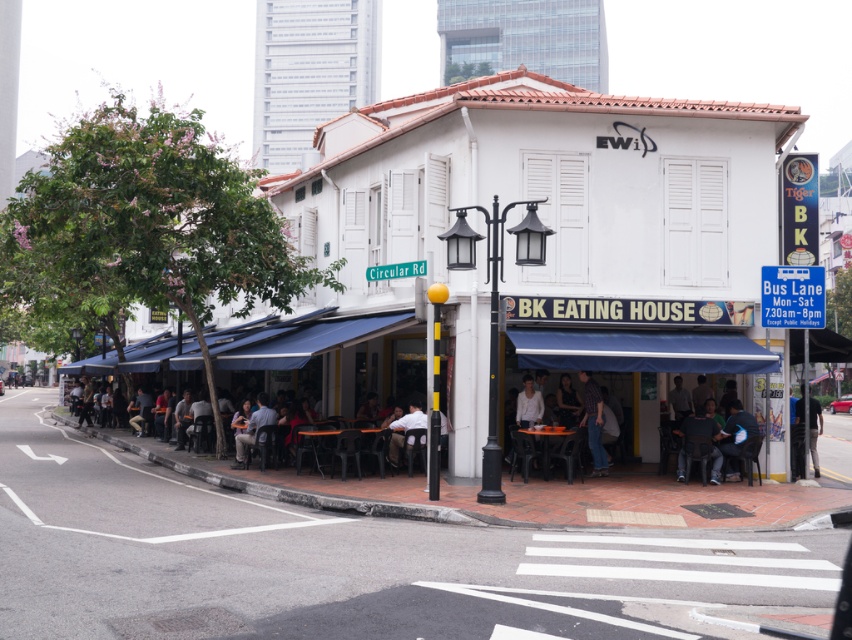
Question: Can you confirm if dark blue shirt at lower right is bigger than matte plastic table at lower center?

Choices:
 (A) no
 (B) yes

Answer: (B)

Question: Which point appears closest to the camera in this image?

Choices:
 (A) (531, 432)
 (B) (542, 401)
 (C) (390, 452)
 (D) (242, 336)

Answer: (A)

Question: Which point appears closest to the camera in this image?

Choices:
 (A) [x=237, y=456]
 (B) [x=740, y=442]

Answer: (B)

Question: Observing the image, what is the correct spatial positioning of plaid shirt at center in reference to matte plastic table at lower center?

Choices:
 (A) left
 (B) right

Answer: (B)

Question: Which object is farther from the camera taking this photo?

Choices:
 (A) plaid shirt at center
 (B) white fabric shirt at center

Answer: (A)

Question: Can you confirm if dark blue shirt at lower right is wider than wooden table at center?

Choices:
 (A) yes
 (B) no

Answer: (B)